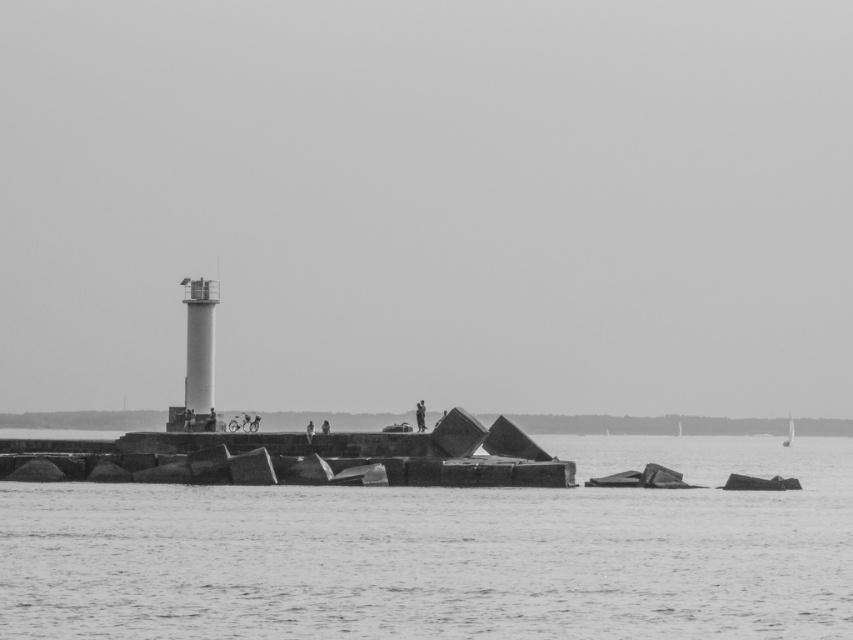
Is smooth concrete water at center positioned in front of white matte sailboat at center?

Yes, it is.

Who is positioned more to the left, smooth concrete water at center or white matte sailboat at center?

Positioned to the left is smooth concrete water at center.

Locate an element on the screen. smooth concrete water at center is located at coordinates (445, 554).